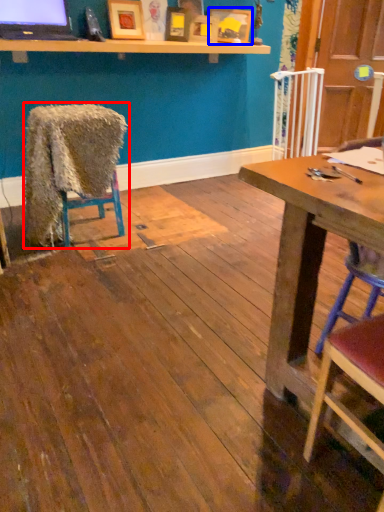
Question: Which of the following is the closest to the observer, chair (highlighted by a red box) or picture frame (highlighted by a blue box)?

Choices:
 (A) chair
 (B) picture frame

Answer: (A)